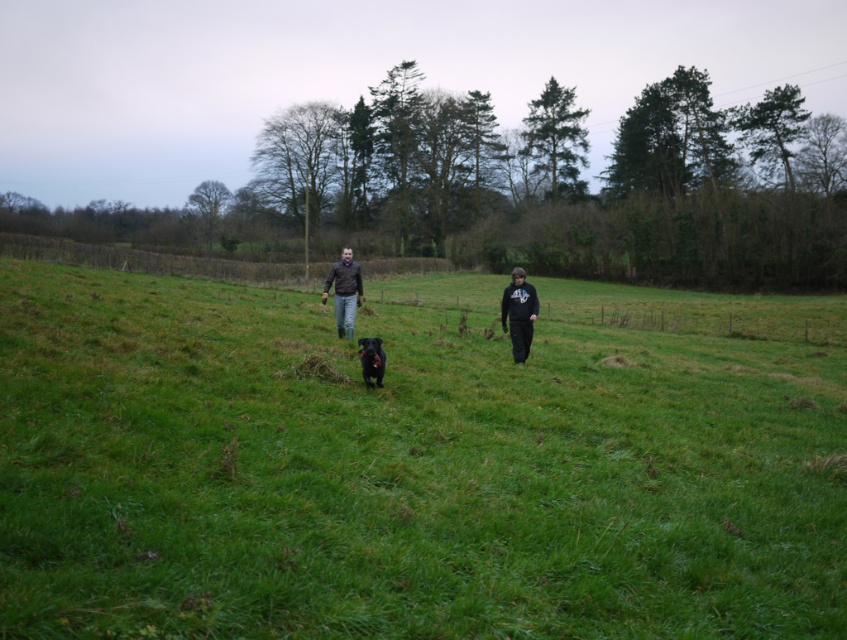
Does green grass at center have a larger size compared to black furry dog at center?

Yes, green grass at center is bigger than black furry dog at center.

Can you confirm if green grass at center is taller than black furry dog at center?

Correct, green grass at center is much taller as black furry dog at center.

Is point (211, 422) positioned in front of point (377, 369)?

Yes, it is in front of point (377, 369).

I want to click on green grass at center, so click(402, 472).

Who is more distant from viewer, (352, 262) or (374, 352)?

Point (352, 262)

The width and height of the screenshot is (847, 640). Describe the element at coordinates (344, 291) in the screenshot. I see `brown leather jacket at center` at that location.

I want to click on brown leather jacket at center, so click(344, 291).

Is point (655, 454) positioned before point (523, 355)?

Yes, it is in front of point (523, 355).

In the scene shown: Is green grass at center shorter than black matte sweatshirt at center?

In fact, green grass at center may be taller than black matte sweatshirt at center.

The width and height of the screenshot is (847, 640). What do you see at coordinates (402, 472) in the screenshot?
I see `green grass at center` at bounding box center [402, 472].

Where is `green grass at center`? green grass at center is located at coordinates (402, 472).